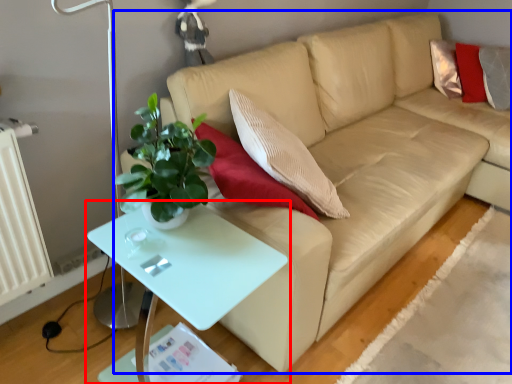
Question: Which object appears closest to the camera in this image, table (highlighted by a red box) or studio couch (highlighted by a blue box)?

Choices:
 (A) table
 (B) studio couch

Answer: (A)